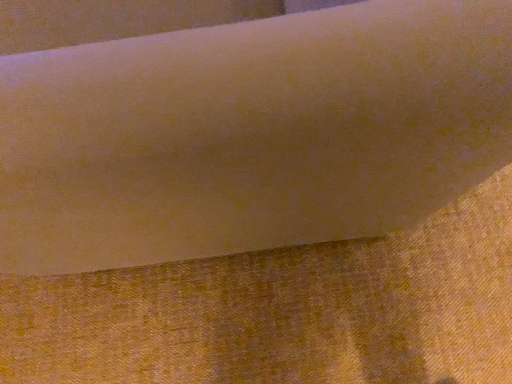
Where is `white matte paper towel at center`? Image resolution: width=512 pixels, height=384 pixels. white matte paper towel at center is located at coordinates (250, 133).

This screenshot has height=384, width=512. Describe the element at coordinates (250, 133) in the screenshot. I see `white matte paper towel at center` at that location.

Where is `white matte paper towel at center`? The image size is (512, 384). white matte paper towel at center is located at coordinates (250, 133).